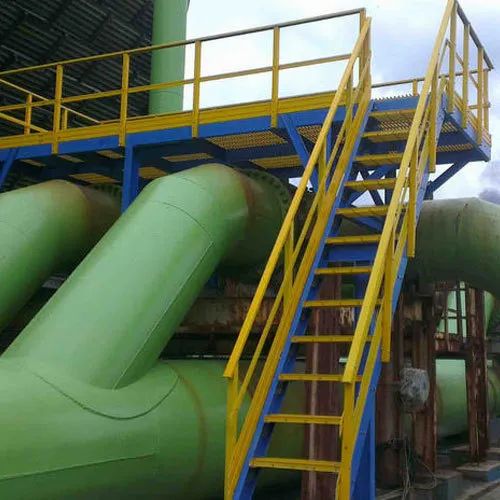
I want to click on 1st stair, so click(x=320, y=473).